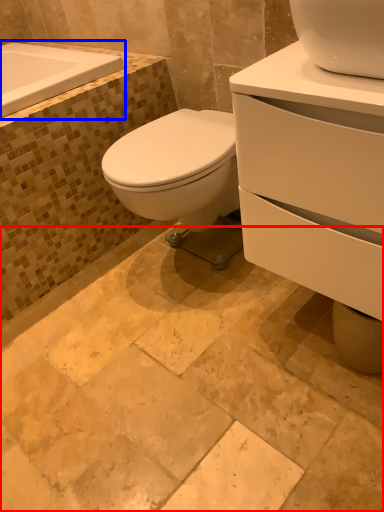
Question: Which point is further to the camera, ceramic tile (highlighted by a red box) or bath (highlighted by a blue box)?

Choices:
 (A) ceramic tile
 (B) bath

Answer: (B)